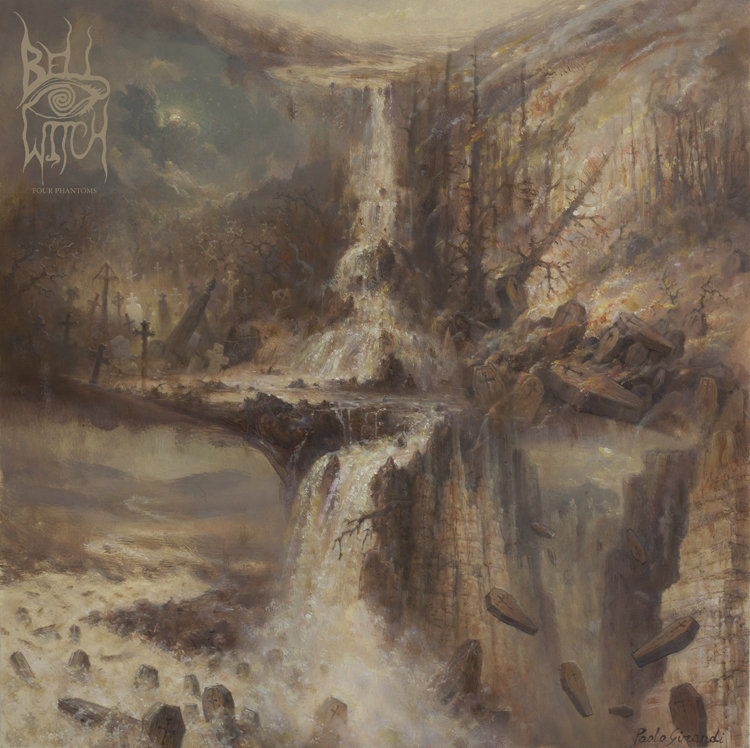
Identify the location of artwork. (400, 408).